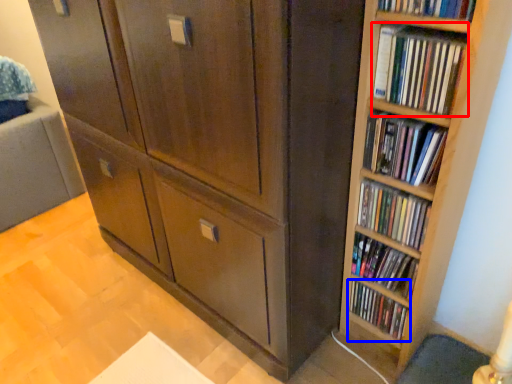
Question: Which point is further to the camera, book (highlighted by a red box) or book (highlighted by a blue box)?

Choices:
 (A) book
 (B) book

Answer: (B)